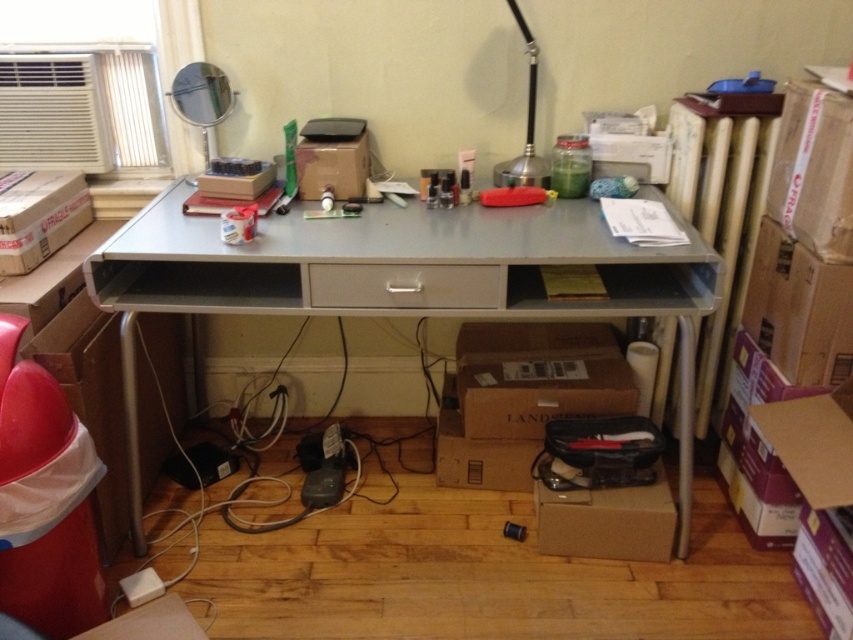
Is brown cardboard box at right taller than cardboard box at lower center?

Yes, brown cardboard box at right is taller than cardboard box at lower center.

Is point (785, 278) farther from camera compared to point (554, 522)?

No, it is not.

Where is `brown cardboard box at right`? Image resolution: width=853 pixels, height=640 pixels. brown cardboard box at right is located at coordinates (799, 308).

Who is positioned more to the left, cardboard box at lower center or matte gray drawer at center?

matte gray drawer at center

What do you see at coordinates (607, 520) in the screenshot? This screenshot has height=640, width=853. I see `cardboard box at lower center` at bounding box center [607, 520].

Between point (601, 500) and point (361, 273), which one is positioned behind?

Positioned behind is point (601, 500).

Where is `cardboard box at lower center`? The image size is (853, 640). cardboard box at lower center is located at coordinates [607, 520].

Between brown cardboard box at right and matte gray drawer at center, which one is positioned lower?

Positioned lower is brown cardboard box at right.

Who is shorter, brown cardboard box at right or matte gray drawer at center?

With less height is matte gray drawer at center.

Between point (805, 298) and point (352, 284), which one is positioned behind?

Positioned behind is point (805, 298).

Locate an element on the screen. brown cardboard box at right is located at coordinates (799, 308).